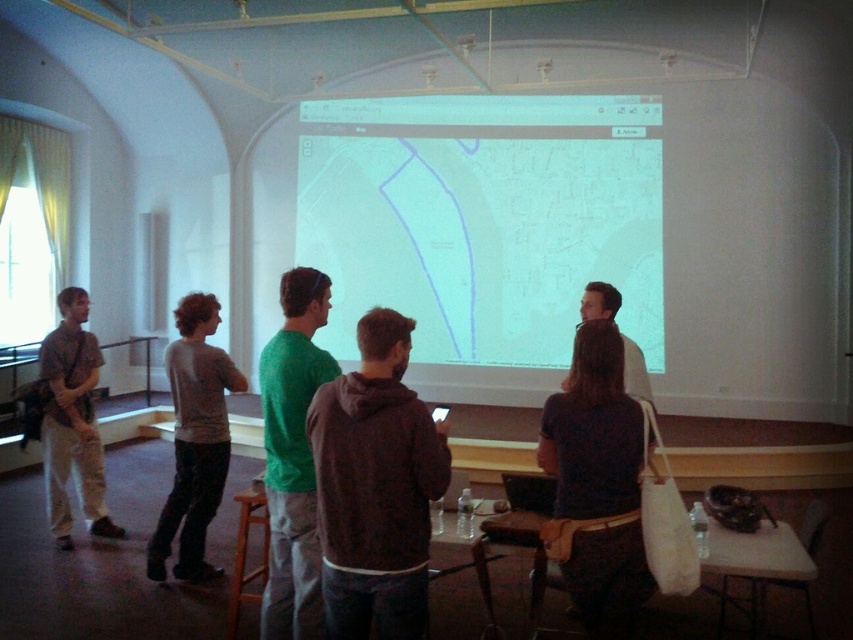
You are attending a meeting and need to pass a note to the person wearing the dark blue shirt at center. The light brown cotton pants at left is blocking your path. Which direction should you move to avoid them?

To avoid the light brown cotton pants at left, move to the right side of the dark blue shirt at center since it is positioned to the right of the light brown cotton pants at left.

You are an attendee at this event and want to hand a document to the person wearing the gray cotton sweater at center. Since you are standing behind the green matte shirt at center, can you reach them directly without moving around?

The green matte shirt at center is closer to the viewer than gray cotton sweater at center, so you are behind the green matte shirt at center and cannot directly reach the gray cotton sweater at center without moving around.